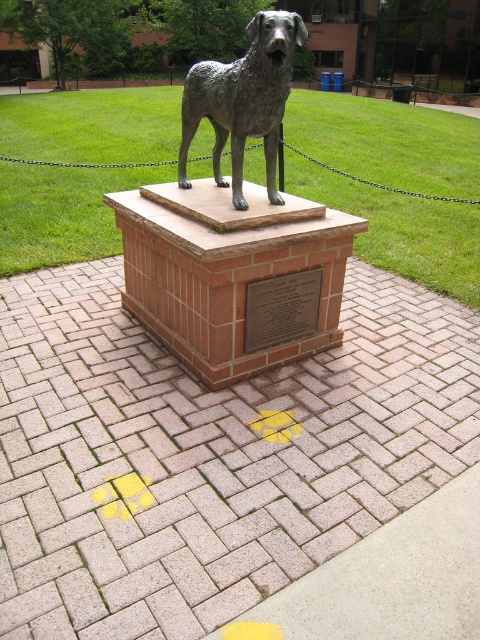
You are a tour guide explaining the statue to visitors. You want to point out the bronze plaque at center to them. Since you are standing in front of the statue, which direction should you direct visitors to look relative to the bronze statue of a dog at center?

The bronze statue of a dog at center is above the bronze plaque at center, so visitors should look downward from the bronze statue of a dog at center to see the bronze plaque at center.